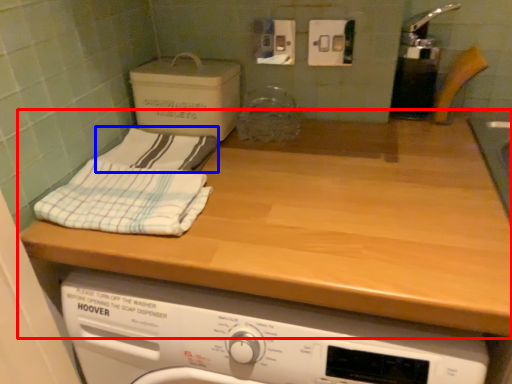
Question: Which point is closer to the camera, countertop (highlighted by a red box) or bath towel (highlighted by a blue box)?

Choices:
 (A) countertop
 (B) bath towel

Answer: (A)